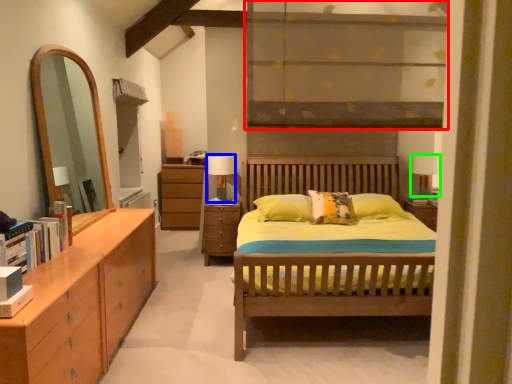
Question: Which object is the closest to the shelf (highlighted by a red box)? Choose among these: table lamp (highlighted by a blue box) or table lamp (highlighted by a green box).

Choices:
 (A) table lamp
 (B) table lamp

Answer: (A)